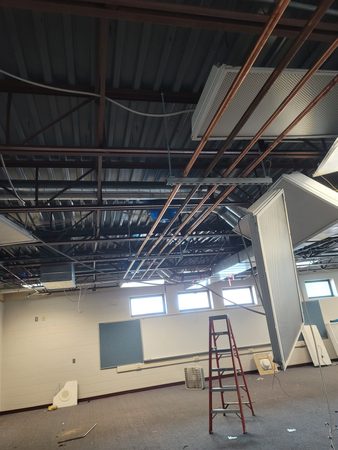
Image resolution: width=338 pixels, height=450 pixels. I want to click on step ladder, so click(x=211, y=334).